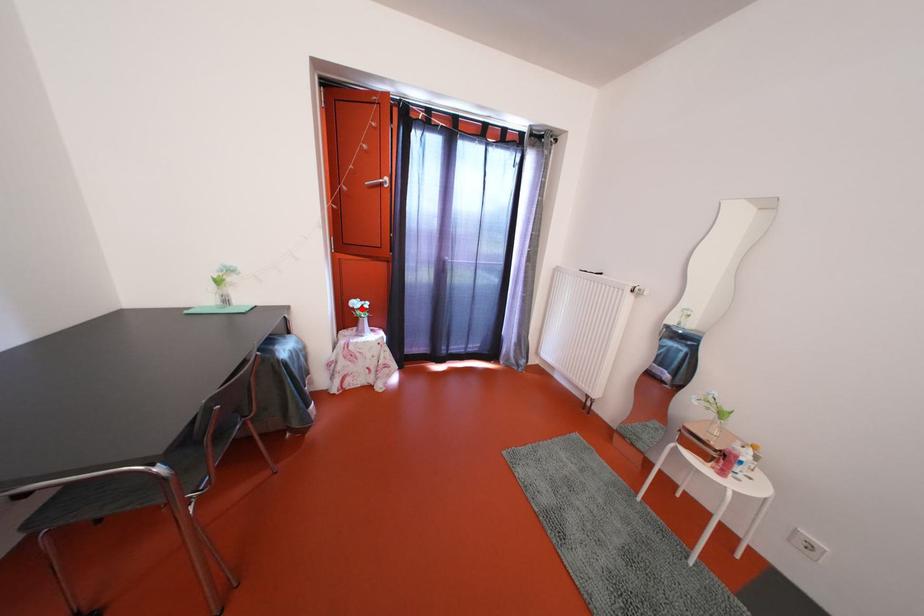
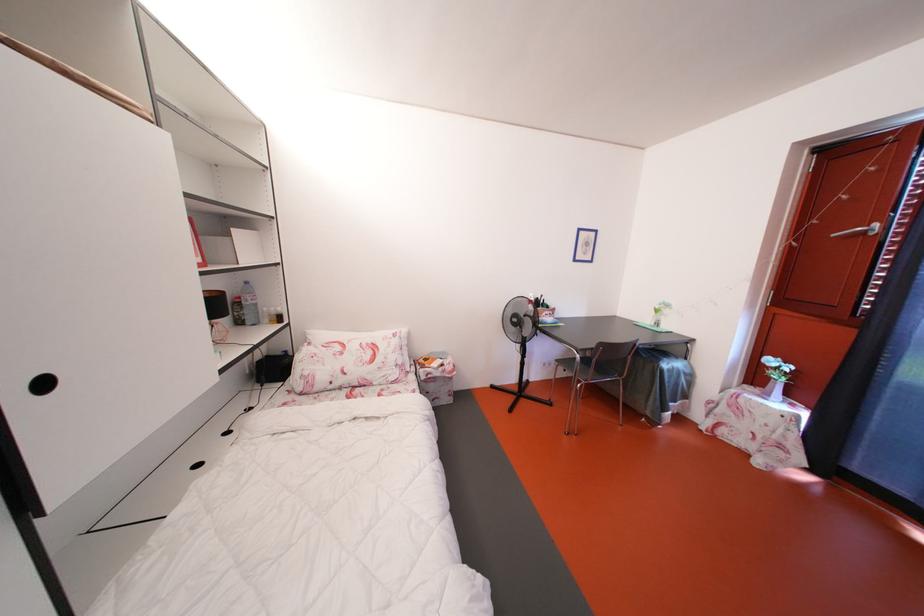
Question: A red point is marked in image1. In image2, is the corresponding 3D point closer to the camera or farther? Reply with the corresponding letter.

Choices:
 (A) The corresponding 3D point is closer.
 (B) The corresponding 3D point is farther.

Answer: (B)